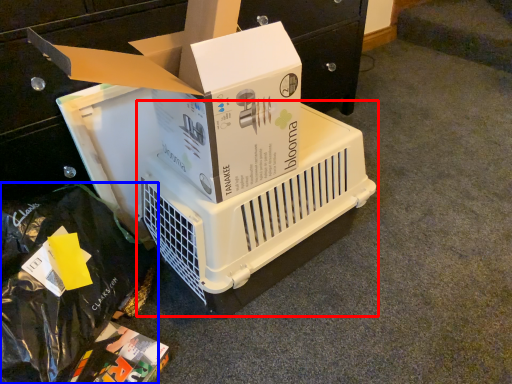
Question: Which of the following is the farthest to the observer, appliance (highlighted by a red box) or garbage (highlighted by a blue box)?

Choices:
 (A) appliance
 (B) garbage

Answer: (A)